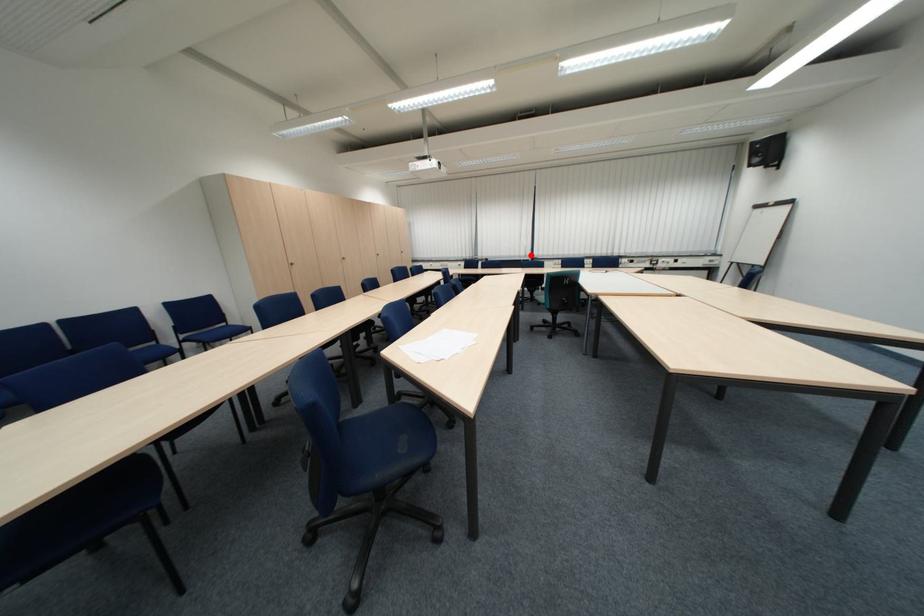
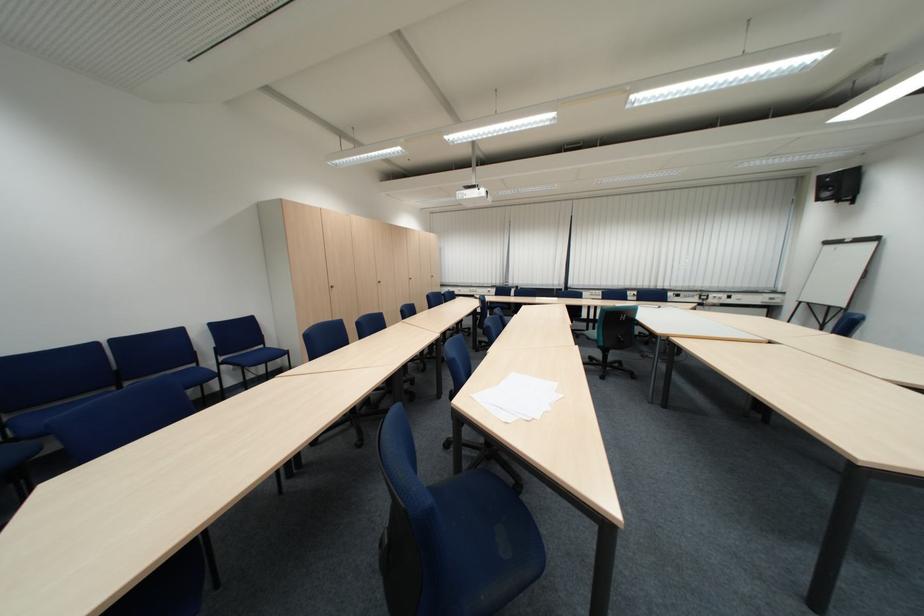
Question: I am providing you with two images of the same scene from different viewpoints. In image1, a red point is highlighted. Considering the same 3D point in image2, which of the following is correct?

Choices:
 (A) It is closer
 (B) It is farther

Answer: (B)